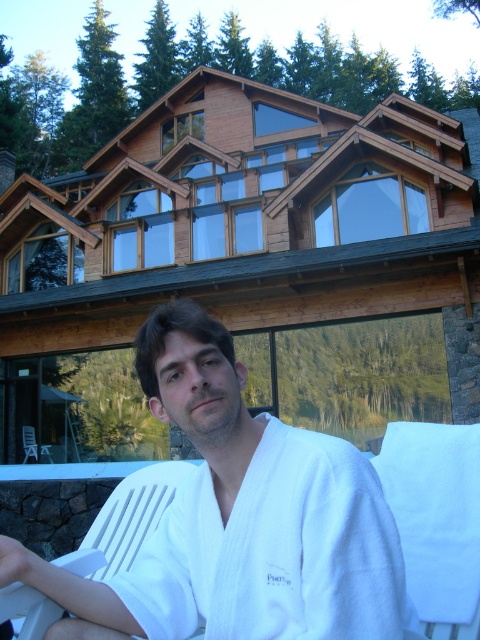
You are standing in front of the house and want to sit down on either the white cotton bathrobe at center or the white plastic chair at lower left. Which object is closer to you so you can reach it without moving further forward?

The white cotton bathrobe at center is closer to the viewer than the white plastic chair at lower left, so you can reach it without moving further forward.

You are standing at point [312,525] and want to reach the entrance of the house. The entrance is 1.61 meters away from your current position. Can you walk straight ahead to reach it without any obstacles?

Yes, you can walk straight ahead to reach the entrance of the house since there are no obstacles mentioned in the scene description between your current position at point [312,525] and the entrance, which is 1.61 meters away.

You are planning to set up a small garden between the white plastic beach chair at lower left and the white plastic chair at lower left. Which chair should you move to make more space for the garden?

You should move the white plastic chair at lower left because it occupies more space than the white plastic beach chair at lower left, allowing more room for the garden.